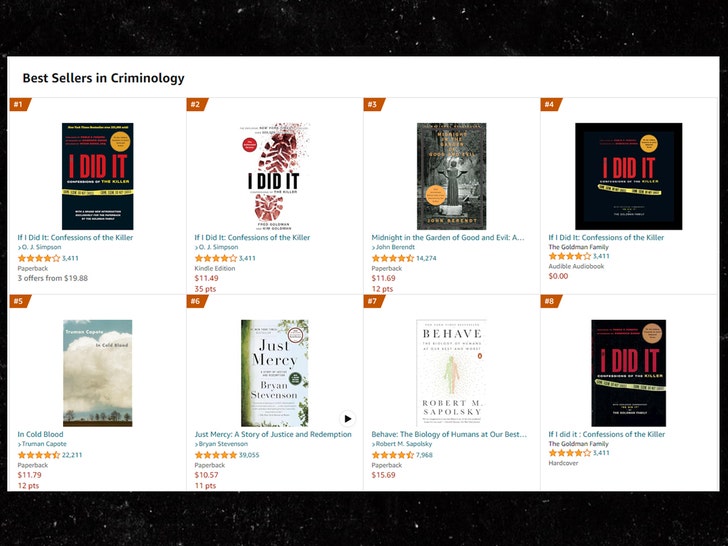
The image size is (728, 546). What are the coordinates of `book covers` in the screenshot? It's located at (63, 204), (250, 181), (466, 179), (617, 187), (625, 387), (447, 372), (242, 384), (138, 376).